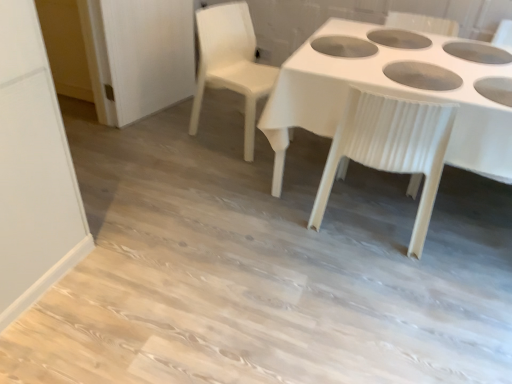
This screenshot has height=384, width=512. I want to click on vacant space to the left of white plastic chair at center, the second chair positioned from the left, so click(266, 210).